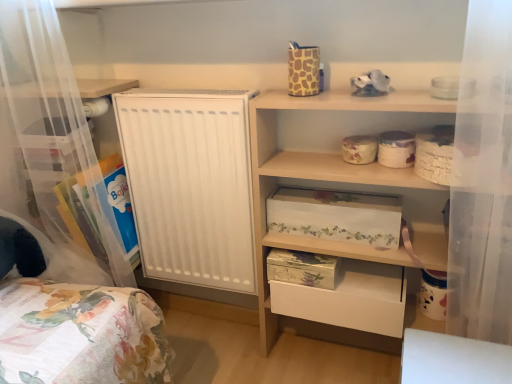
Question: Considering the relative sizes of floral-patterned cardboard box at center, the second storage box positioned from the top, and wooden shelf at upper right, marked as the first shelf in a right-to-left arrangement, in the image provided, is floral-patterned cardboard box at center, the second storage box positioned from the top, thinner than wooden shelf at upper right, marked as the first shelf in a right-to-left arrangement,?

Choices:
 (A) no
 (B) yes

Answer: (B)

Question: Is floral-patterned cardboard box at center, the second storage box positioned from the top, shorter than wooden shelf at upper right, marked as the first shelf in a right-to-left arrangement?

Choices:
 (A) yes
 (B) no

Answer: (A)

Question: Is the depth of floral-patterned cardboard box at center, the second storage box positioned from the top, less than that of wooden shelf at upper right, arranged as the 2th shelf when viewed from the left?

Choices:
 (A) no
 (B) yes

Answer: (A)

Question: Is floral-patterned cardboard box at center, which is the second storage box in bottom-to-top order, positioned far away from wooden shelf at upper right, marked as the first shelf in a right-to-left arrangement?

Choices:
 (A) yes
 (B) no

Answer: (B)

Question: Considering the relative sizes of floral-patterned cardboard box at center, which is the second storage box in bottom-to-top order, and wooden shelf at upper right, arranged as the 2th shelf when viewed from the left, in the image provided, is floral-patterned cardboard box at center, which is the second storage box in bottom-to-top order, bigger than wooden shelf at upper right, arranged as the 2th shelf when viewed from the left,?

Choices:
 (A) no
 (B) yes

Answer: (A)

Question: Does floral-patterned cardboard box at center, which is the second storage box in bottom-to-top order, appear on the right side of wooden shelf at upper right, marked as the first shelf in a right-to-left arrangement?

Choices:
 (A) yes
 (B) no

Answer: (B)

Question: From a real-world perspective, does floral-patterned cardboard box at upper center, the third storage box ordered from the bottom, stand above floral paper storage box at lower center, which is counted as the third storage box, starting from the top?

Choices:
 (A) yes
 (B) no

Answer: (A)

Question: Considering the relative positions of floral-patterned cardboard box at upper center, acting as the 1th storage box starting from the top, and floral paper storage box at lower center, which is counted as the third storage box, starting from the top, in the image provided, is floral-patterned cardboard box at upper center, acting as the 1th storage box starting from the top, to the right of floral paper storage box at lower center, which is counted as the third storage box, starting from the top, from the viewer's perspective?

Choices:
 (A) yes
 (B) no

Answer: (A)

Question: From a real-world perspective, is floral-patterned cardboard box at upper center, acting as the 1th storage box starting from the top, located beneath floral paper storage box at lower center, which is counted as the third storage box, starting from the top?

Choices:
 (A) yes
 (B) no

Answer: (B)

Question: Is floral paper storage box at lower center, which is counted as the third storage box, starting from the top, surrounded by floral-patterned cardboard box at upper center, acting as the 1th storage box starting from the top?

Choices:
 (A) yes
 (B) no

Answer: (B)

Question: Does floral-patterned cardboard box at upper center, the third storage box ordered from the bottom, turn towards floral paper storage box at lower center, which is the 1th storage box from bottom to top?

Choices:
 (A) yes
 (B) no

Answer: (B)

Question: Would you say floral-patterned cardboard box at upper center, the third storage box ordered from the bottom, is a long distance from floral paper storage box at lower center, which is counted as the third storage box, starting from the top?

Choices:
 (A) yes
 (B) no

Answer: (B)

Question: From the image's perspective, is floral-patterned cardboard box at upper center, the third storage box ordered from the bottom, over clear plastic storage at left, which is the 1th shelf in left-to-right order?

Choices:
 (A) no
 (B) yes

Answer: (B)